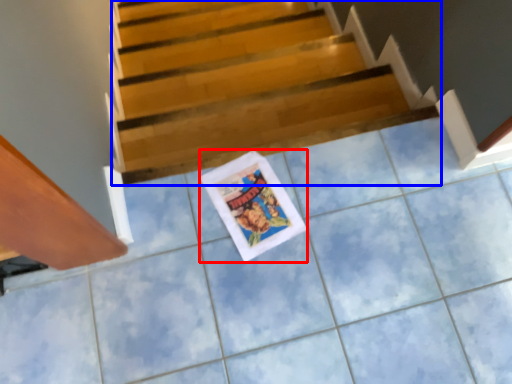
Question: Which object is further to the camera taking this photo, comic book (highlighted by a red box) or stairs (highlighted by a blue box)?

Choices:
 (A) comic book
 (B) stairs

Answer: (B)